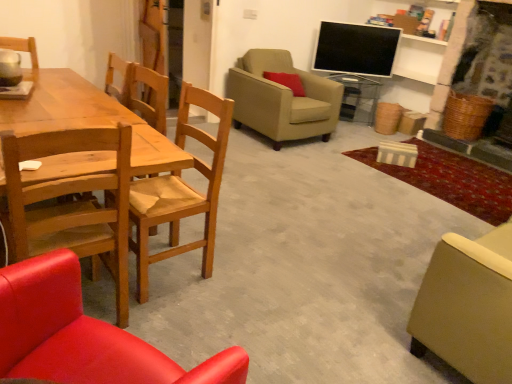
Where is `free location in front of beige fabric armchair at center, which is counted as the 5th chair, starting from the front`? This screenshot has width=512, height=384. free location in front of beige fabric armchair at center, which is counted as the 5th chair, starting from the front is located at coordinates (297, 158).